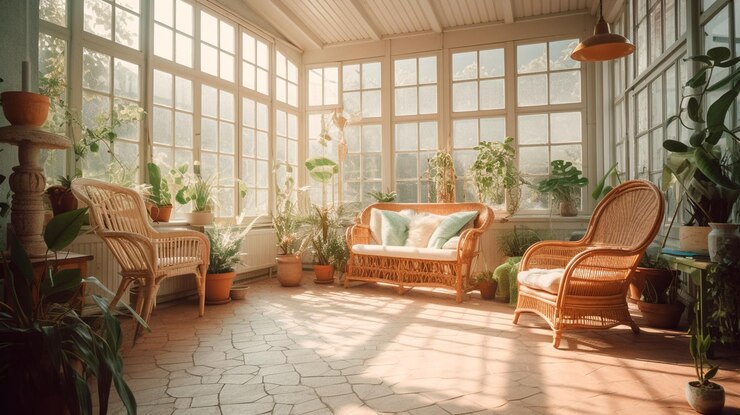
At what (x,y) coordinates should I click in order to perform the action: click on chair legs. Please return your answer as a coordinate pair (x, y). Image resolution: width=740 pixels, height=415 pixels. Looking at the image, I should click on (144, 310), (120, 299), (197, 297), (556, 338), (519, 318), (636, 333), (485, 295), (462, 299), (403, 291), (346, 286).